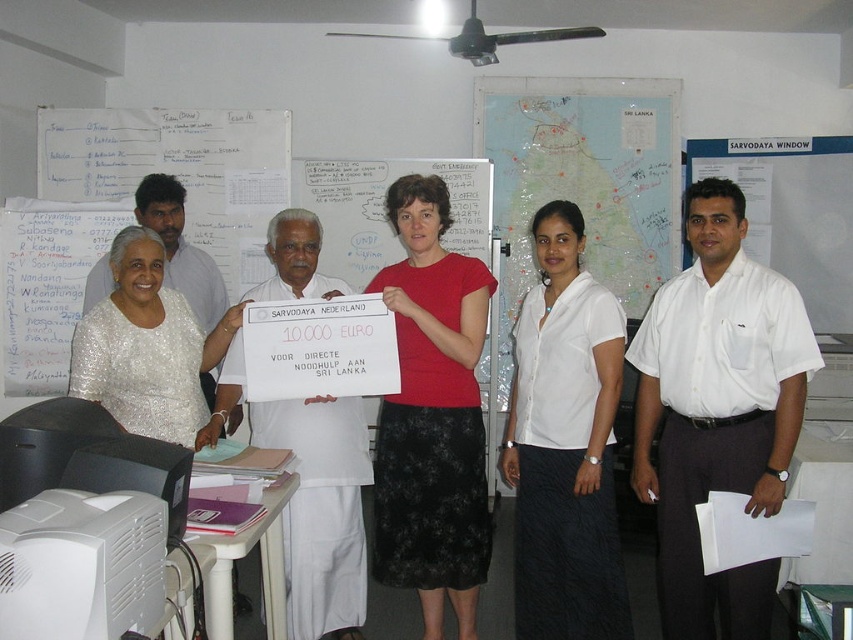
Question: Is red matte shirt at center below white cloth at center?

Choices:
 (A) yes
 (B) no

Answer: (B)

Question: Which object is the closest to the white shirt at left?

Choices:
 (A) red matte shirt at center
 (B) white cloth at center
 (C) white shirt at center
 (D) white sequined dress at center

Answer: (D)

Question: Is white shirt at center to the left of white matte shirt at center from the viewer's perspective?

Choices:
 (A) no
 (B) yes

Answer: (A)

Question: Does white matte shirt at center have a greater width compared to red matte shirt at center?

Choices:
 (A) yes
 (B) no

Answer: (B)

Question: Estimate the real-world distances between objects in this image. Which object is farther from the white matte shirt at center?

Choices:
 (A) red matte shirt at center
 (B) white shirt at left
 (C) white shirt at center
 (D) white sequined dress at center

Answer: (B)

Question: Which point is closer to the camera taking this photo?

Choices:
 (A) (354, 451)
 (B) (758, 387)
 (C) (108, 253)
 (D) (148, 204)

Answer: (B)